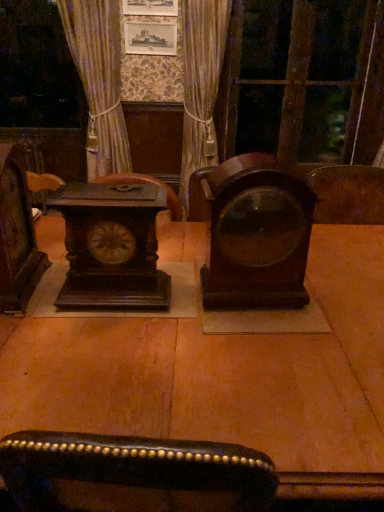
Question: Can you confirm if velvet gold curtain at center is positioned to the right of dark brown wood clock at left, the 2th alarm clock in the right-to-left sequence?

Choices:
 (A) yes
 (B) no

Answer: (A)

Question: Considering the relative positions of velvet gold curtain at center and dark brown wood clock at left, the 2th alarm clock in the right-to-left sequence, in the image provided, is velvet gold curtain at center behind dark brown wood clock at left, the 2th alarm clock in the right-to-left sequence,?

Choices:
 (A) no
 (B) yes

Answer: (B)

Question: Is velvet gold curtain at center not close to dark brown wood clock at left, the 2th alarm clock in the right-to-left sequence?

Choices:
 (A) yes
 (B) no

Answer: (A)

Question: Is the depth of velvet gold curtain at center less than that of dark brown wood clock at left, the 2th alarm clock in the right-to-left sequence?

Choices:
 (A) no
 (B) yes

Answer: (A)

Question: From the image's perspective, is velvet gold curtain at center located above dark brown wood clock at left, the 2th alarm clock in the right-to-left sequence?

Choices:
 (A) yes
 (B) no

Answer: (A)

Question: Is velvet gold curtain at center outside dark brown wood clock at left, positioned as the 1th alarm clock in left-to-right order?

Choices:
 (A) no
 (B) yes

Answer: (B)

Question: Can we say dark wood table at center lies outside velvet gold curtain at center?

Choices:
 (A) no
 (B) yes

Answer: (B)

Question: From the image's perspective, is dark wood table at center located above velvet gold curtain at center?

Choices:
 (A) no
 (B) yes

Answer: (A)

Question: Can you confirm if dark wood table at center is bigger than velvet gold curtain at center?

Choices:
 (A) yes
 (B) no

Answer: (A)

Question: From a real-world perspective, does dark wood table at center sit lower than velvet gold curtain at center?

Choices:
 (A) yes
 (B) no

Answer: (A)

Question: Is dark wood table at center in front of velvet gold curtain at center?

Choices:
 (A) yes
 (B) no

Answer: (A)

Question: Is dark wood table at center facing away from velvet gold curtain at center?

Choices:
 (A) no
 (B) yes

Answer: (A)

Question: Is mahogany wood alarm clock at center, which is counted as the 1th alarm clock, starting from the right, oriented towards dark wood clock at left?

Choices:
 (A) no
 (B) yes

Answer: (A)